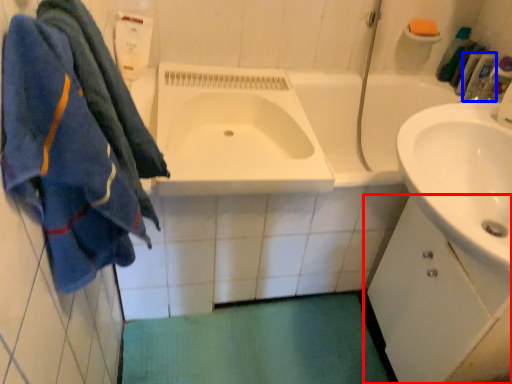
Question: Among these objects, which one is nearest to the camera, bathroom cabinet (highlighted by a red box) or toiletry (highlighted by a blue box)?

Choices:
 (A) bathroom cabinet
 (B) toiletry

Answer: (A)